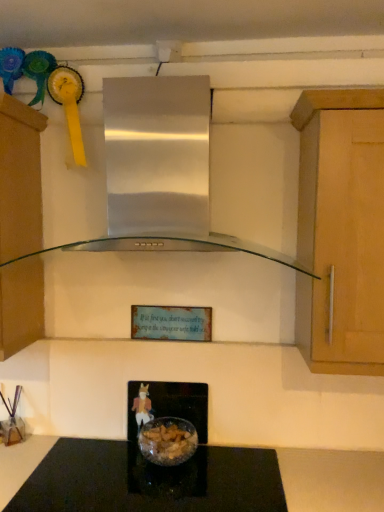
Question: Is translucent glass bowl at center in front of or behind stainless steel range hood at center in the image?

Choices:
 (A) behind
 (B) front

Answer: (A)

Question: From the image's perspective, is translucent glass bowl at center above or below stainless steel range hood at center?

Choices:
 (A) above
 (B) below

Answer: (B)

Question: Which object is positioned farthest from the translucent glass bowl at center?

Choices:
 (A) matte brown cabinet at left
 (B) stainless steel range hood at center
 (C) black glass countertop at center

Answer: (B)

Question: Estimate the real-world distances between objects in this image. Which object is closer to the black glass countertop at center?

Choices:
 (A) matte brown cabinet at left
 (B) stainless steel range hood at center
 (C) translucent glass bowl at center

Answer: (C)